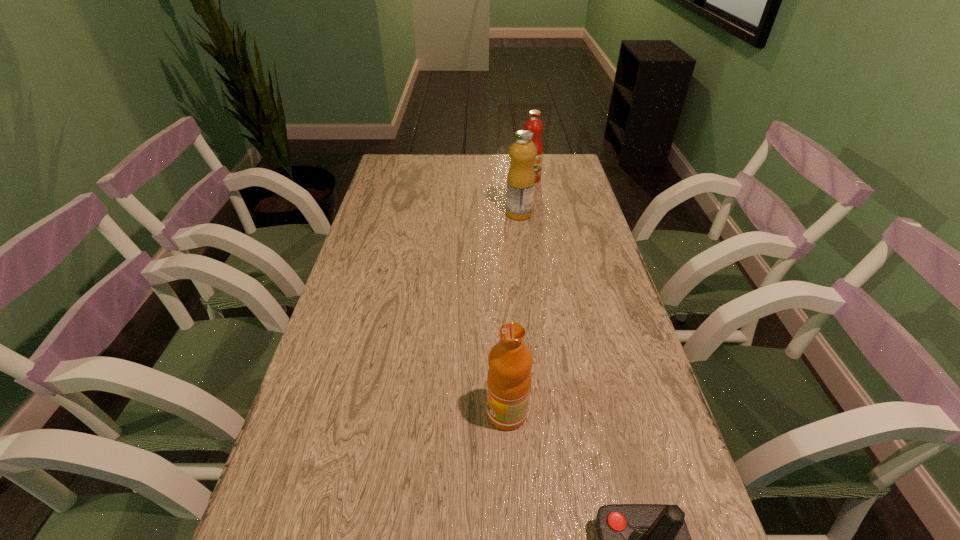
The image size is (960, 540). Identify the location of the second farthest object. (521, 177).

Identify the location of the farthest object. The image size is (960, 540). (534, 124).

Image resolution: width=960 pixels, height=540 pixels. I want to click on the nearest fruit juice, so click(510, 361).

Identify the location of vacant space located 0.160m on the front label of the second nearest fruit juice. (456, 214).

Find the location of a particular element. The width and height of the screenshot is (960, 540). free location located on the front label of the second nearest fruit juice is located at coordinates (444, 214).

Identify the location of free space located 0.090m on the front label of the second nearest fruit juice. 478,214.

The width and height of the screenshot is (960, 540). I want to click on vacant space located 0.140m on the front label of the farthest object, so click(535, 205).

This screenshot has height=540, width=960. I want to click on vacant space located on the label side of the third farthest object, so click(326, 413).

Identify the location of vacant area located 0.380m on the label side of the third farthest object. Image resolution: width=960 pixels, height=540 pixels. (297, 413).

You are a GUI agent. You are given a task and a screenshot of the screen. Output one action in this format:
    pyautogui.click(x=<x>, y=<y>)
    Task: Click on the free location located 0.070m on the label side of the third farthest object
    The height and width of the screenshot is (540, 960).
    Given the screenshot: What is the action you would take?
    pyautogui.click(x=451, y=413)